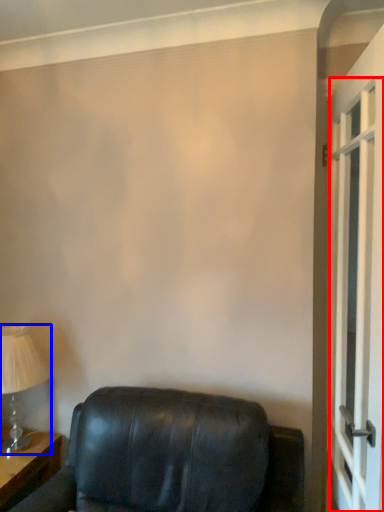
Question: Which point is closer to the camera, screen door (highlighted by a red box) or table lamp (highlighted by a blue box)?

Choices:
 (A) screen door
 (B) table lamp

Answer: (A)